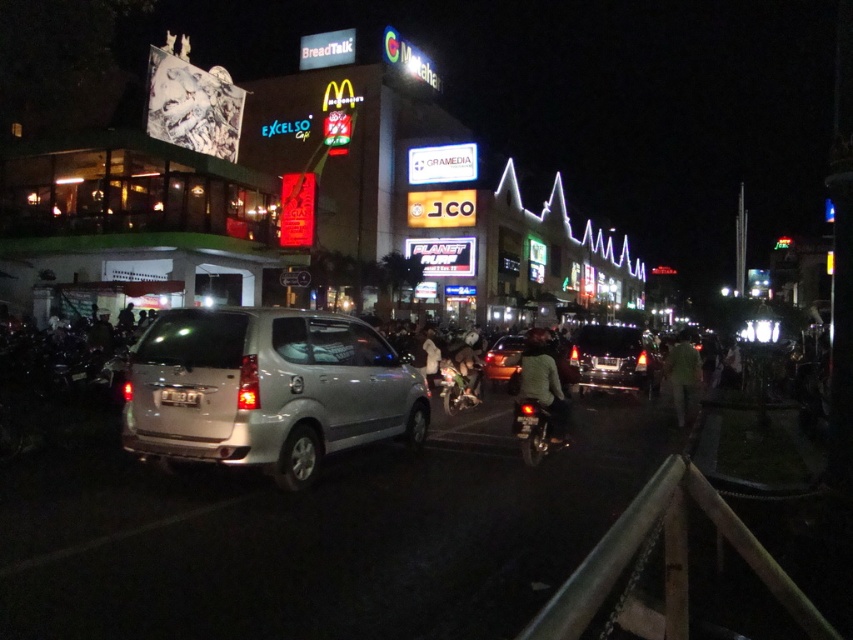
This screenshot has height=640, width=853. What do you see at coordinates (611, 358) in the screenshot? I see `satin black suv at center` at bounding box center [611, 358].

Is satin black suv at center taller than metallic silver motorcycle at center?

Yes, satin black suv at center is taller than metallic silver motorcycle at center.

Find the location of a particular element. This screenshot has height=640, width=853. satin black suv at center is located at coordinates (x=611, y=358).

Which is above, black matte motorcycle at center or white fabric person at center?

white fabric person at center

Is black matte motorcycle at center to the left of white fabric person at center from the viewer's perspective?

No, black matte motorcycle at center is not to the left of white fabric person at center.

The height and width of the screenshot is (640, 853). What do you see at coordinates (537, 429) in the screenshot?
I see `black matte motorcycle at center` at bounding box center [537, 429].

Identify the location of black matte motorcycle at center. This screenshot has height=640, width=853. (537, 429).

Can you confirm if satin black suv at center is positioned above green fabric person at right?

Correct, satin black suv at center is located above green fabric person at right.

Does point (590, 339) come closer to viewer compared to point (679, 396)?

No, it is not.

Does point (596, 326) come in front of point (688, 348)?

That is False.

This screenshot has width=853, height=640. I want to click on satin black suv at center, so click(611, 358).